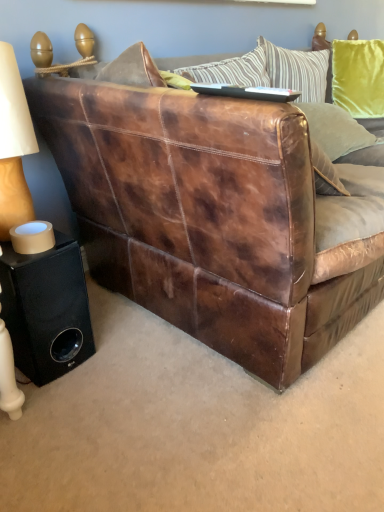
Question: Is matte beige lampshade at left turned away from brown leather couch at center?

Choices:
 (A) no
 (B) yes

Answer: (A)

Question: From a real-world perspective, is matte beige lampshade at left on brown leather couch at center?

Choices:
 (A) no
 (B) yes

Answer: (B)

Question: Is matte beige lampshade at left wider than brown leather couch at center?

Choices:
 (A) yes
 (B) no

Answer: (B)

Question: Is matte beige lampshade at left outside of brown leather couch at center?

Choices:
 (A) no
 (B) yes

Answer: (B)

Question: Is matte beige lampshade at left far from brown leather couch at center?

Choices:
 (A) yes
 (B) no

Answer: (B)

Question: From a real-world perspective, is velvet green pillow at upper right positioned above or below matte beige lampshade at left?

Choices:
 (A) above
 (B) below

Answer: (B)

Question: In terms of height, does velvet green pillow at upper right look taller or shorter compared to matte beige lampshade at left?

Choices:
 (A) short
 (B) tall

Answer: (A)

Question: Does point click(324, 104) appear closer or farther from the camera than point click(26, 214)?

Choices:
 (A) farther
 (B) closer

Answer: (A)

Question: In terms of width, does velvet green pillow at upper right look wider or thinner when compared to matte beige lampshade at left?

Choices:
 (A) thin
 (B) wide

Answer: (B)

Question: From a real-world perspective, relative to black matte speaker at lower left, is matte beige lampshade at left vertically above or below?

Choices:
 (A) below
 (B) above

Answer: (B)

Question: Visually, is matte beige lampshade at left positioned to the left or to the right of black matte speaker at lower left?

Choices:
 (A) right
 (B) left

Answer: (B)

Question: Relative to black matte speaker at lower left, is matte beige lampshade at left in front or behind?

Choices:
 (A) behind
 (B) front

Answer: (B)

Question: From their relative heights in the image, would you say matte beige lampshade at left is taller or shorter than black matte speaker at lower left?

Choices:
 (A) tall
 (B) short

Answer: (A)

Question: From the image's perspective, is black matte speaker at lower left located above or below matte beige lampshade at left?

Choices:
 (A) above
 (B) below

Answer: (B)

Question: Considering their positions, is black matte speaker at lower left located in front of or behind matte beige lampshade at left?

Choices:
 (A) behind
 (B) front

Answer: (A)